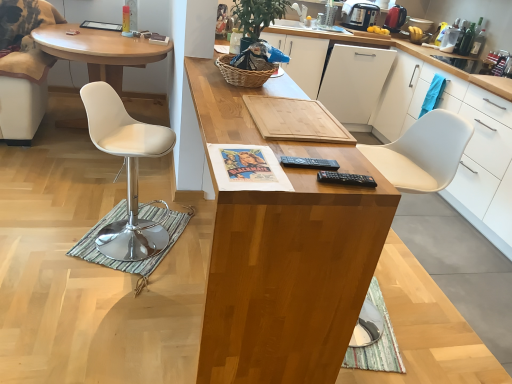
This screenshot has height=384, width=512. I want to click on vacant area that is in front of black plastic remote control at center, which appears as the first remote control when viewed from the top, so click(x=297, y=184).